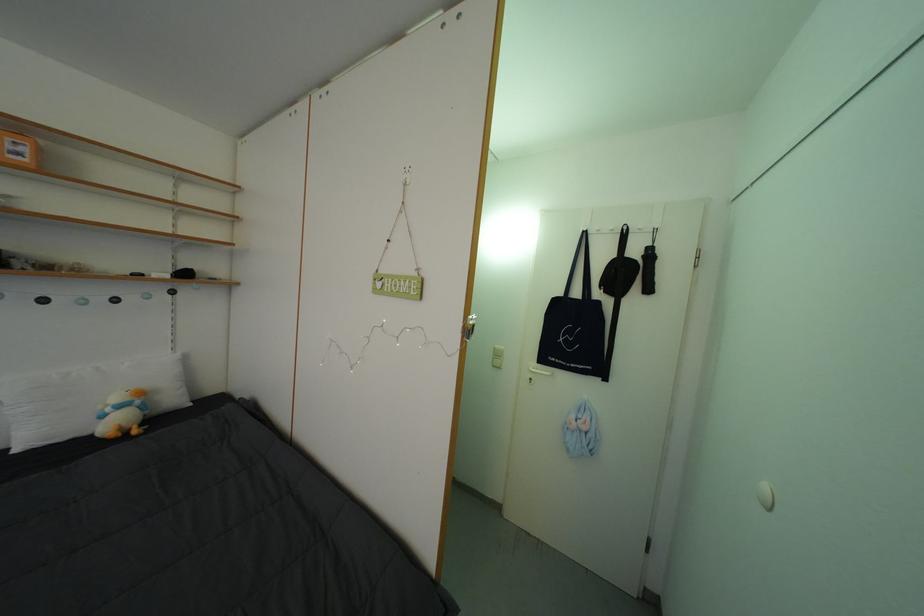
Find where to press the white light switch. Please return your answer as a coordinate pair (x, y).

(496, 357)